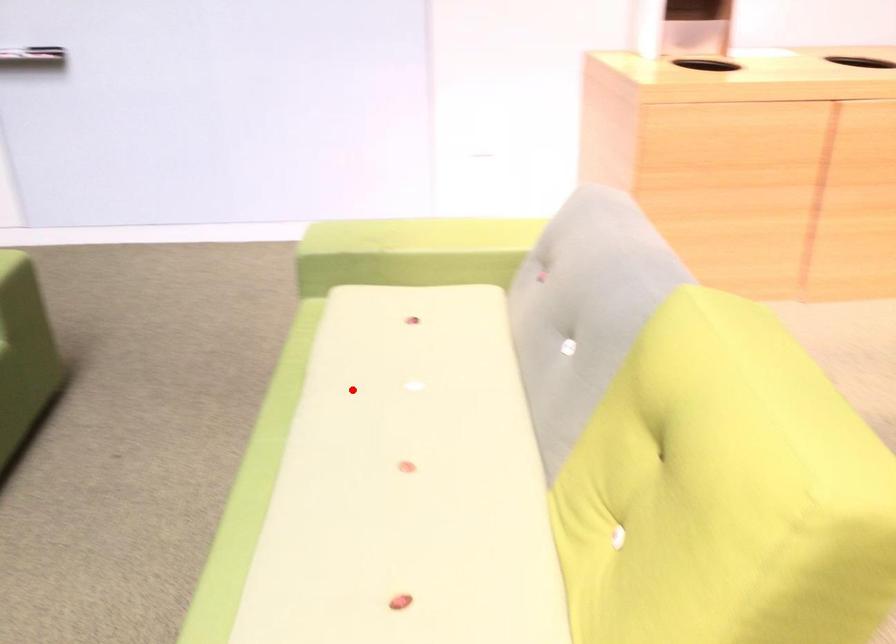
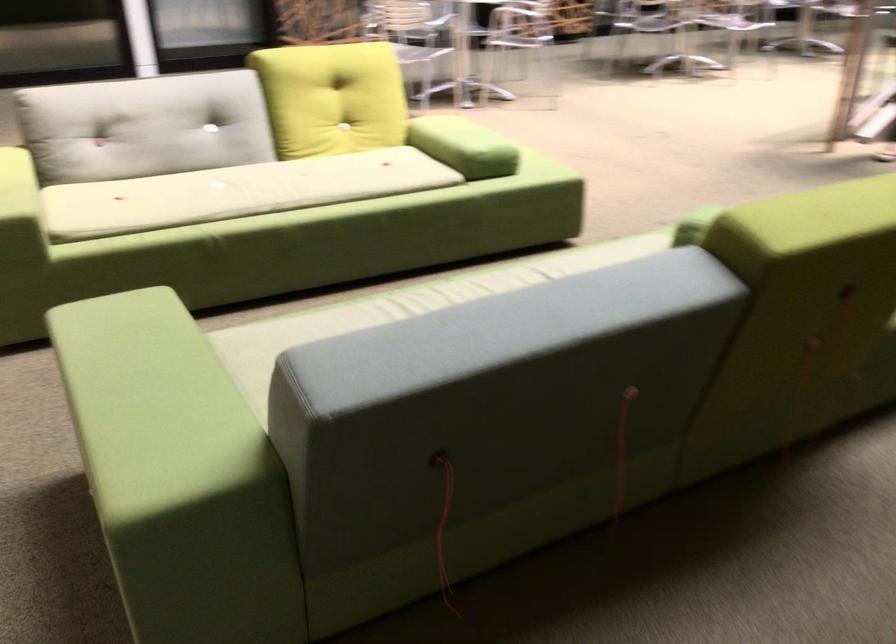
Locate, in the second image, the point that corresponds to the highlighted location in the first image.

(236, 192)